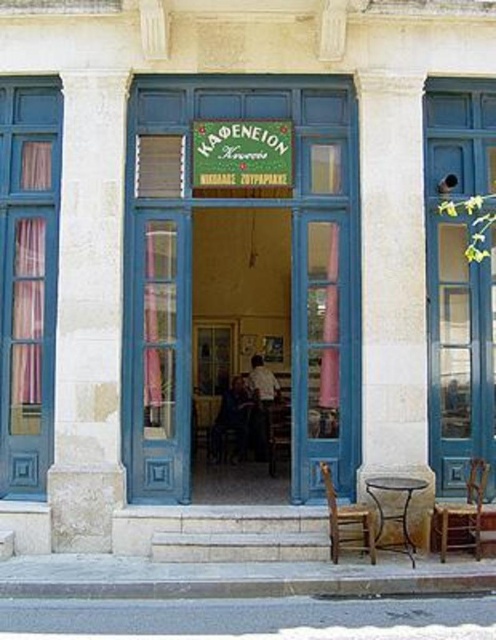
In the scene shown: Who is lower down, white stone pillar at left or wooden chair at lower center?

wooden chair at lower center is below.

Find the location of a particular element. The width and height of the screenshot is (496, 640). white stone pillar at left is located at coordinates (88, 316).

Between blue painted wood window at left and metallic brown stool at lower right, which one has less height?

metallic brown stool at lower right

Is blue painted wood window at left thinner than metallic brown stool at lower right?

No, blue painted wood window at left is not thinner than metallic brown stool at lower right.

At what (x,y) coordinates should I click in order to perform the action: click on blue painted wood window at left. Please return your answer as a coordinate pair (x, y). This screenshot has height=640, width=496. Looking at the image, I should click on (27, 278).

Does white stone pillar at left have a lesser height compared to blue painted wood window at left?

Correct, white stone pillar at left is not as tall as blue painted wood window at left.

Can you confirm if white stone pillar at left is positioned to the left of blue painted wood window at left?

No, white stone pillar at left is not to the left of blue painted wood window at left.

Is point (72, 284) less distant than point (59, 157)?

Yes, it is.

What are the coordinates of `white stone pillar at left` in the screenshot? It's located at (88, 316).